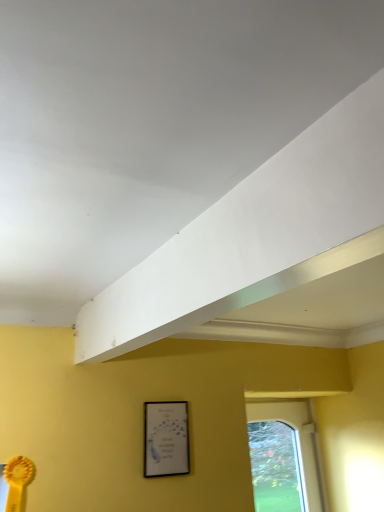
Question: Does white matte exhaust hood at upper center have a smaller size compared to clear glass window at lower right?

Choices:
 (A) yes
 (B) no

Answer: (A)

Question: From a real-world perspective, is white matte exhaust hood at upper center beneath clear glass window at lower right?

Choices:
 (A) yes
 (B) no

Answer: (B)

Question: From the image's perspective, is white matte exhaust hood at upper center beneath clear glass window at lower right?

Choices:
 (A) no
 (B) yes

Answer: (A)

Question: Is white matte exhaust hood at upper center facing away from clear glass window at lower right?

Choices:
 (A) yes
 (B) no

Answer: (B)

Question: Considering the relative sizes of white matte exhaust hood at upper center and clear glass window at lower right in the image provided, is white matte exhaust hood at upper center taller than clear glass window at lower right?

Choices:
 (A) no
 (B) yes

Answer: (A)

Question: Relative to clear glass window at lower right, is white matte exhaust hood at upper center in front or behind?

Choices:
 (A) behind
 (B) front

Answer: (B)

Question: Choose the correct answer: Is white matte exhaust hood at upper center inside clear glass window at lower right or outside it?

Choices:
 (A) inside
 (B) outside

Answer: (B)

Question: Is white matte exhaust hood at upper center taller or shorter than clear glass window at lower right?

Choices:
 (A) short
 (B) tall

Answer: (A)

Question: Is white matte exhaust hood at upper center bigger or smaller than clear glass window at lower right?

Choices:
 (A) big
 (B) small

Answer: (B)

Question: Is matte black picture frame at lower center bigger or smaller than clear glass window at lower right?

Choices:
 (A) small
 (B) big

Answer: (A)

Question: Is matte black picture frame at lower center in front of or behind clear glass window at lower right in the image?

Choices:
 (A) behind
 (B) front

Answer: (B)

Question: From the image's perspective, is matte black picture frame at lower center positioned above or below clear glass window at lower right?

Choices:
 (A) above
 (B) below

Answer: (A)

Question: Is matte black picture frame at lower center inside the boundaries of clear glass window at lower right, or outside?

Choices:
 (A) outside
 (B) inside

Answer: (A)

Question: In terms of width, does white matte exhaust hood at upper center look wider or thinner when compared to matte black picture frame at lower center?

Choices:
 (A) thin
 (B) wide

Answer: (B)

Question: From the image's perspective, is white matte exhaust hood at upper center above or below matte black picture frame at lower center?

Choices:
 (A) above
 (B) below

Answer: (A)